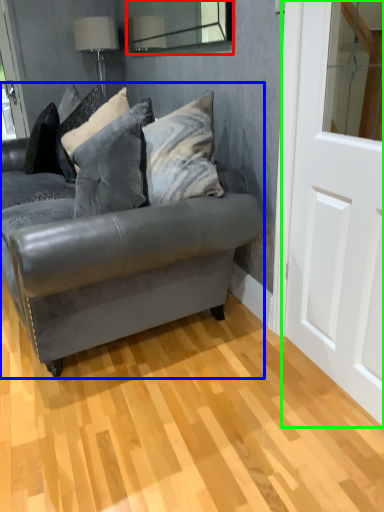
Question: Estimate the real-world distances between objects in this image. Which object is farther from mirror (highlighted by a red box), studio couch (highlighted by a blue box) or screen door (highlighted by a green box)?

Choices:
 (A) studio couch
 (B) screen door

Answer: (B)